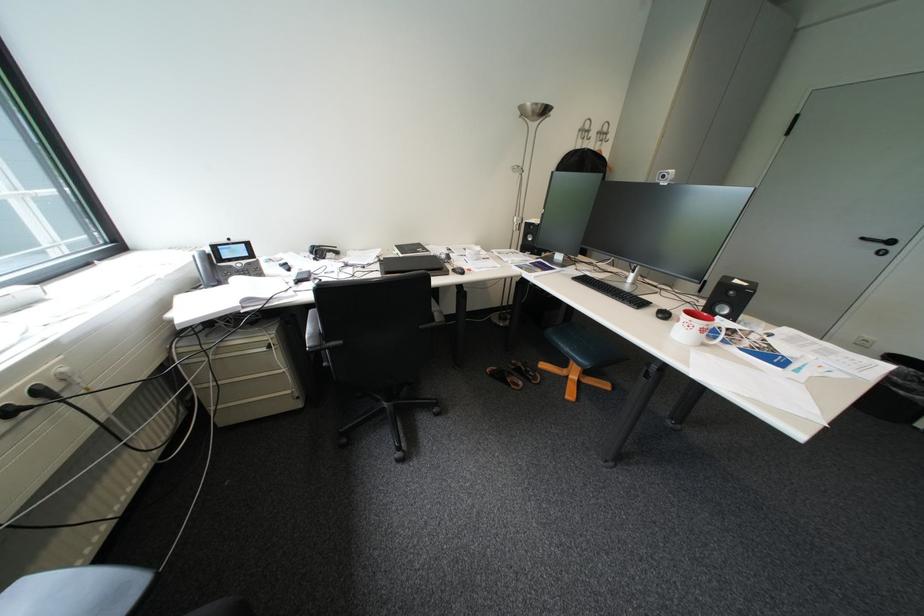
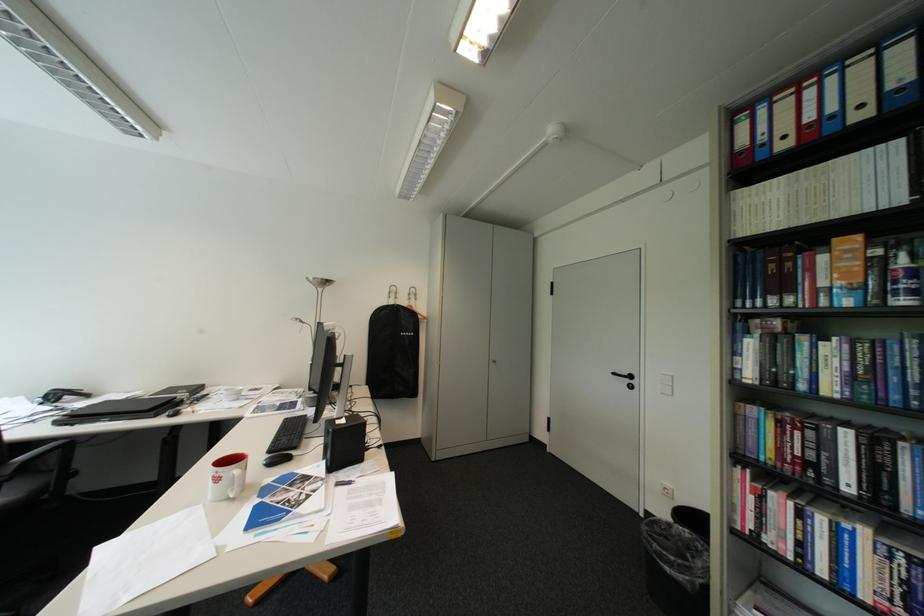
Locate, in the second image, the point that corresponds to [876,240] in the first image.

(626, 374)